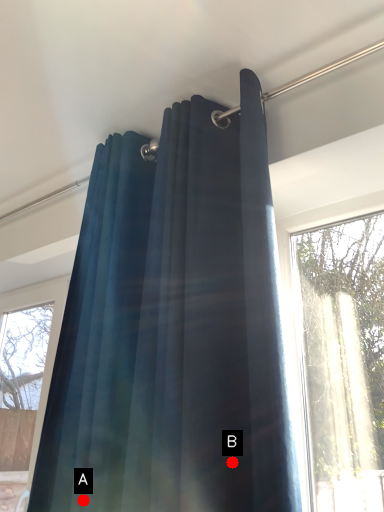
Question: Two points are circled on the image, labeled by A and B beside each circle. Among these points, which one is farthest from the camera?

Choices:
 (A) A is further
 (B) B is further

Answer: (A)